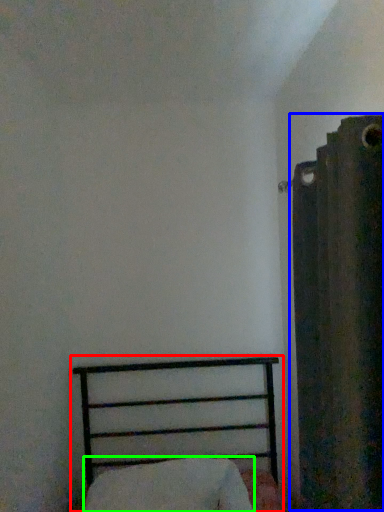
Question: Estimate the real-world distances between objects in this image. Which object is closer to bed (highlighted by a red box), curtain (highlighted by a blue box) or pillow (highlighted by a green box)?

Choices:
 (A) curtain
 (B) pillow

Answer: (B)